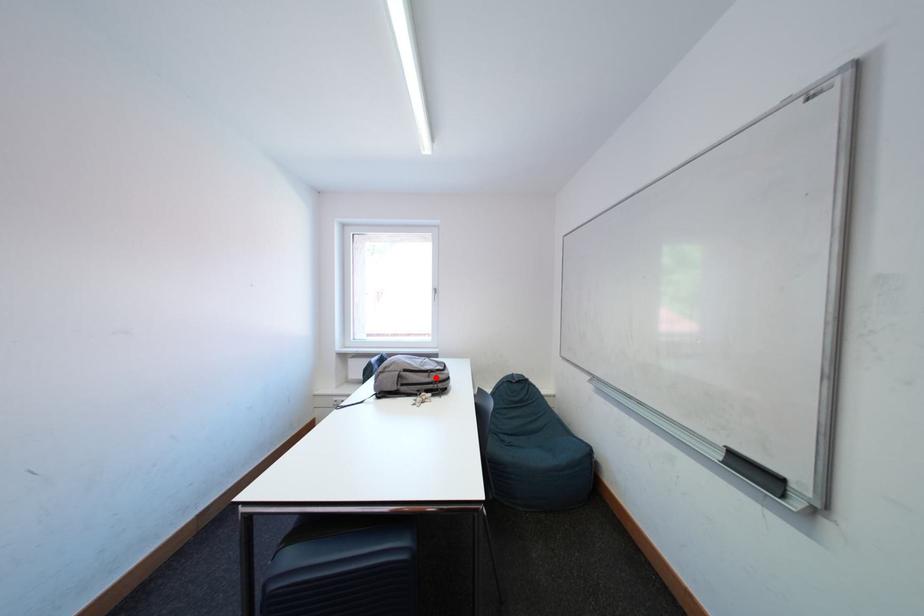
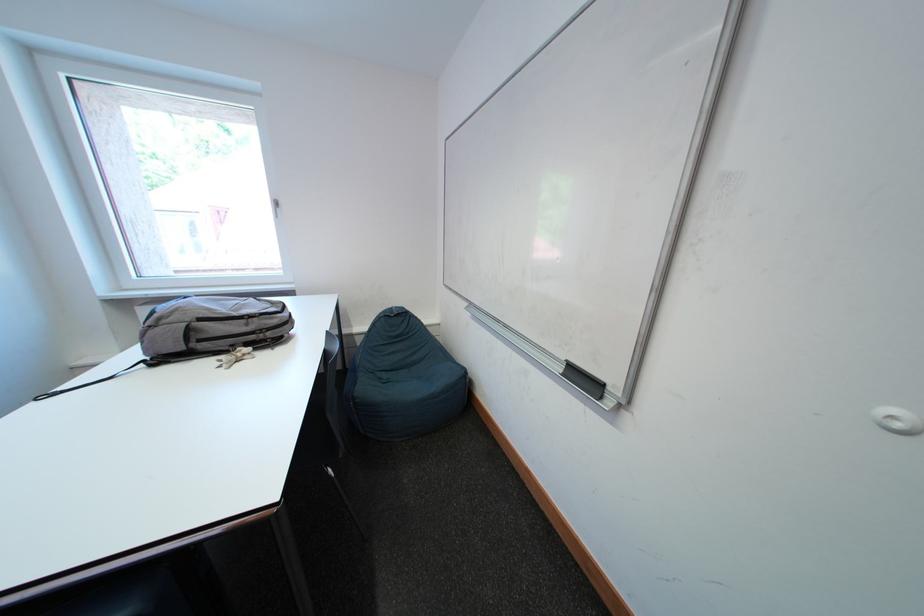
In the second image, find the point that corresponds to the highlighted location in the first image.

(252, 325)